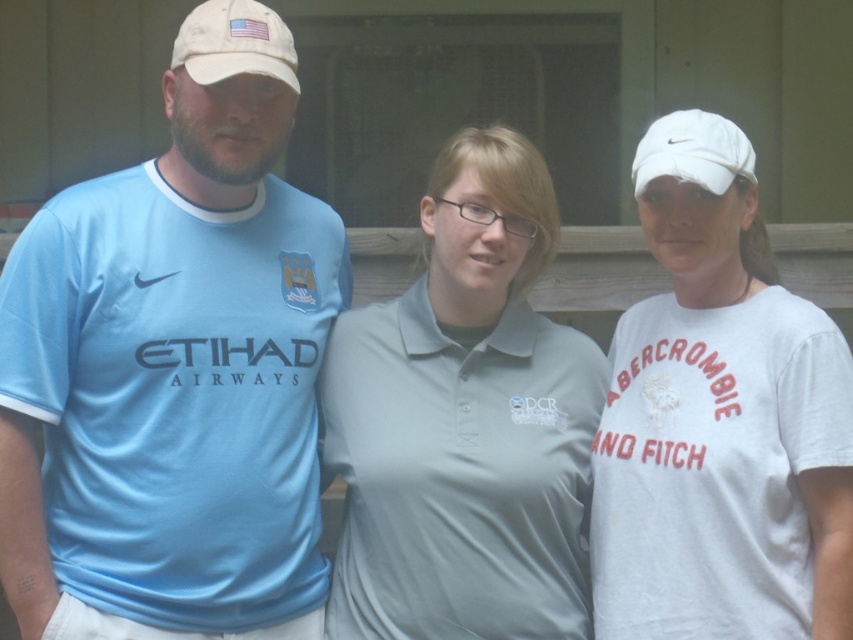
You are a photographer standing in front of the building. You want to take a photo of the light blue jersey at left and the white fabric baseball cap at upper right so that both are clearly visible. Based on their positions, which object is closer to you and might block the view of the other?

The light blue jersey at left is in front of the white fabric baseball cap at upper right, so the light blue jersey at left is closer and might block the view of the white fabric baseball cap at upper right.

You are a photographer trying to capture a group photo of the three people in the scene. You want to ensure that the white fabric baseball cap at upper left is centered in the frame. Given its coordinates are at point 0.067, 0.275, what adjustment should you make to the camera position?

To center the white fabric baseball cap at upper left located at coordinates (234, 42), you should move the camera to the right and down slightly so that the cap is positioned at the center of the frame.